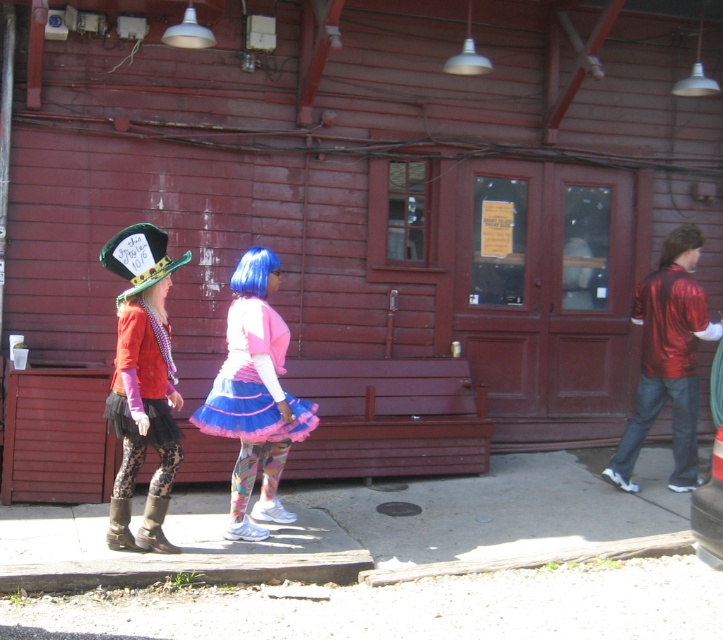
Question: Does matte green hat at left have a smaller size compared to multicolored tulle skirt at center?

Choices:
 (A) no
 (B) yes

Answer: (A)

Question: Estimate the real-world distances between objects in this image. Which object is closer to the matte green hat at left?

Choices:
 (A) multicolored tulle skirt at center
 (B) leather boot at lower left

Answer: (B)

Question: From the image, what is the correct spatial relationship of leather boot at lower left in relation to leather boots at lower left?

Choices:
 (A) above
 (B) below

Answer: (B)

Question: Is shiny red jacket at right below multicolored tulle skirt at center?

Choices:
 (A) yes
 (B) no

Answer: (B)

Question: Which point is farther to the camera?

Choices:
 (A) leather boots at lower left
 (B) leather boot at lower left
 (C) matte green hat at left
 (D) shiny red jacket at right

Answer: (D)

Question: Which object is positioned closest to the shiny red jacket at right?

Choices:
 (A) matte green hat at left
 (B) multicolored tulle skirt at center
 (C) matte black tutu at left

Answer: (B)